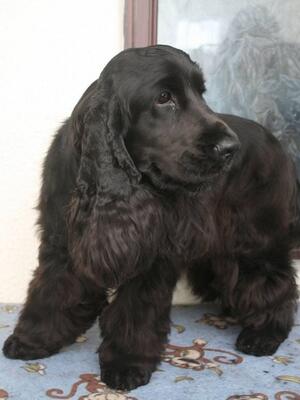
The height and width of the screenshot is (400, 300). What are the coordinates of `glass` in the screenshot? It's located at (222, 44).